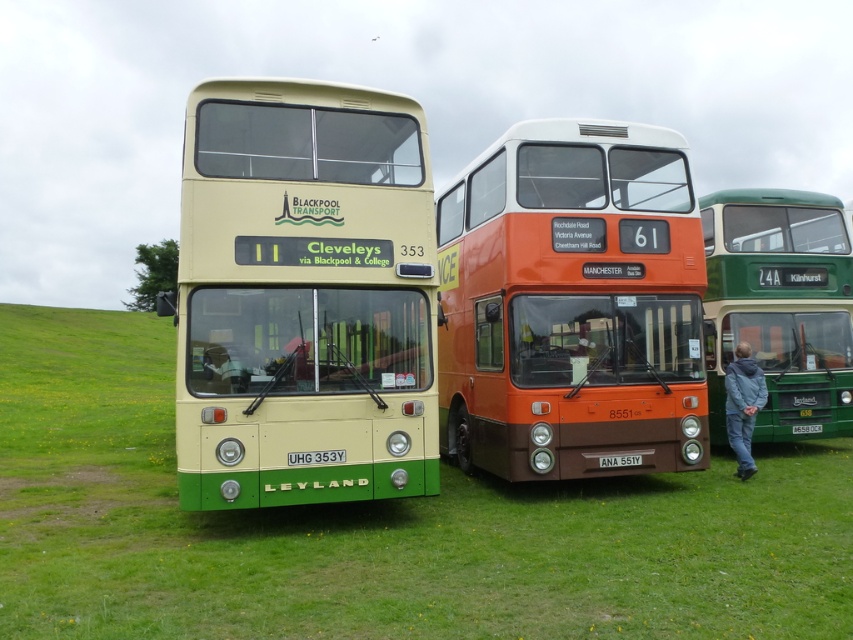
You are a delivery person who needs to place a large package that is 4 meters long between the orange metallic bus at center and the gray fabric jacket at lower right. Is there enough space to place the package without overlapping either object?

The orange metallic bus at center is 4.22 meters from the gray fabric jacket at lower right. Since the package is 4 meters long, there is enough space to place it between them without overlapping either object.

You are standing at the origin point of the coordinate system placed at the bottom left corner of the image. You want to locate the orange metallic bus at center. What are its coordinates?

The orange metallic bus at center is located at coordinates point (572, 304).